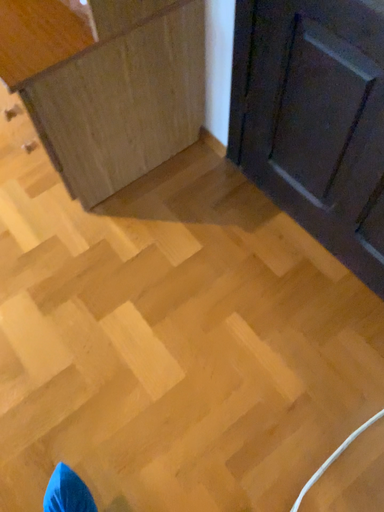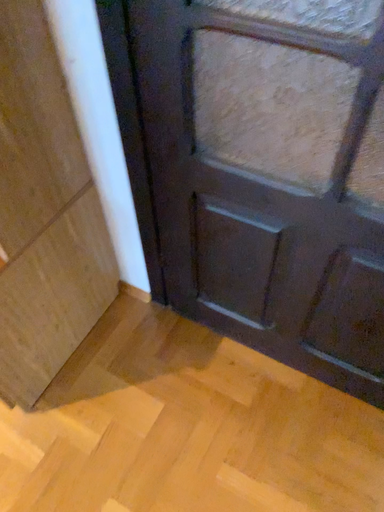
Question: Which way did the camera rotate in the video?

Choices:
 (A) rotated upward
 (B) rotated downward

Answer: (A)